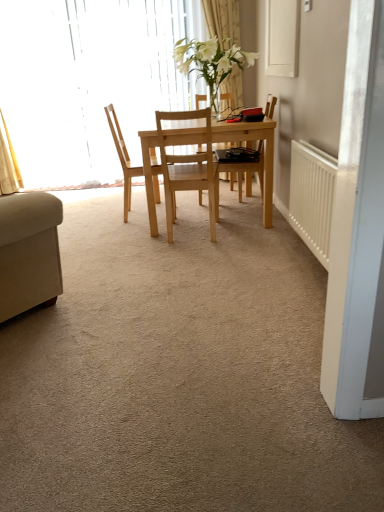
What are the coordinates of `free spot to the left of natural wood chair at center, positioned as the 1th chair in right-to-left order` in the screenshot? It's located at (130, 240).